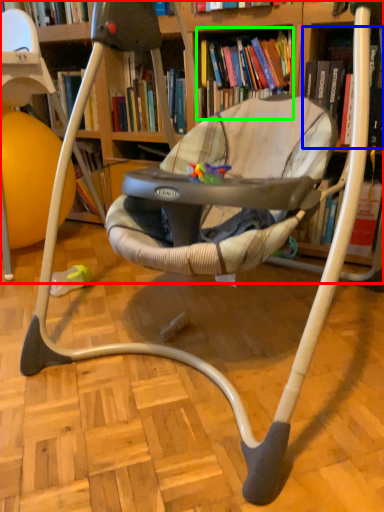
Question: Considering the real-world distances, which object is closest to bookcase (highlighted by a red box)? book (highlighted by a blue box) or book (highlighted by a green box).

Choices:
 (A) book
 (B) book

Answer: (B)